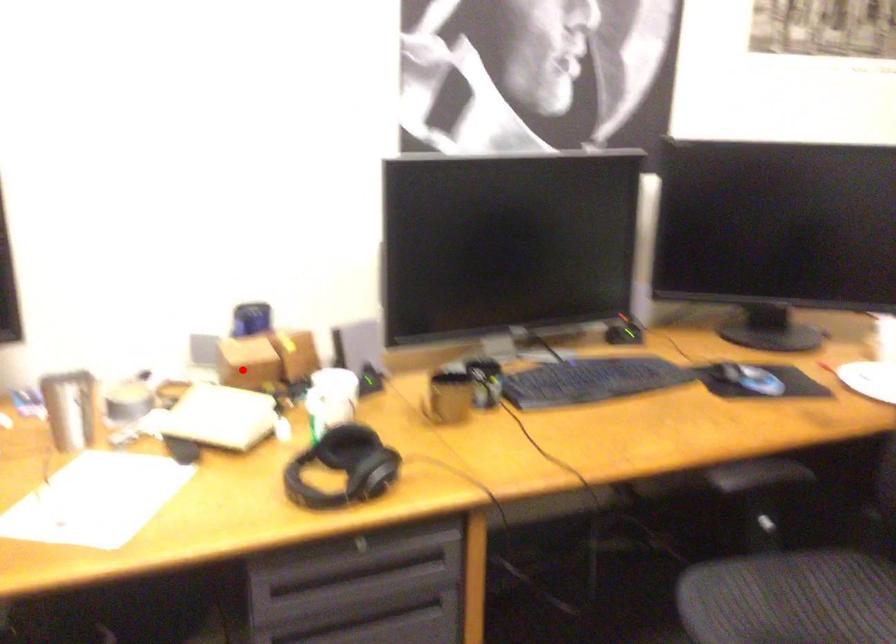
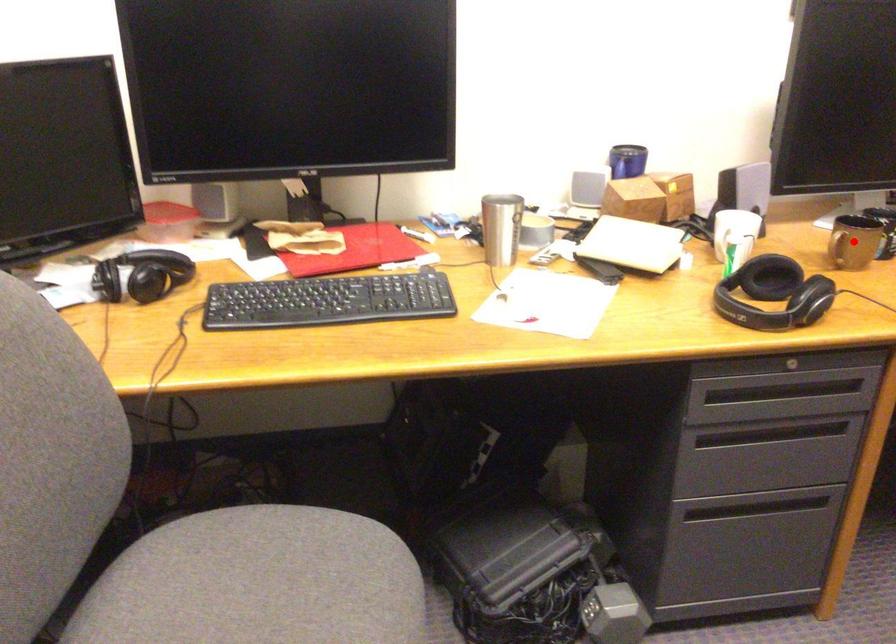
I am providing you with two images of the same scene from different viewpoints. A red point is marked on the first image and another point is marked on the second image. Does the point marked in image1 correspond to the same location as the one in image2?

No